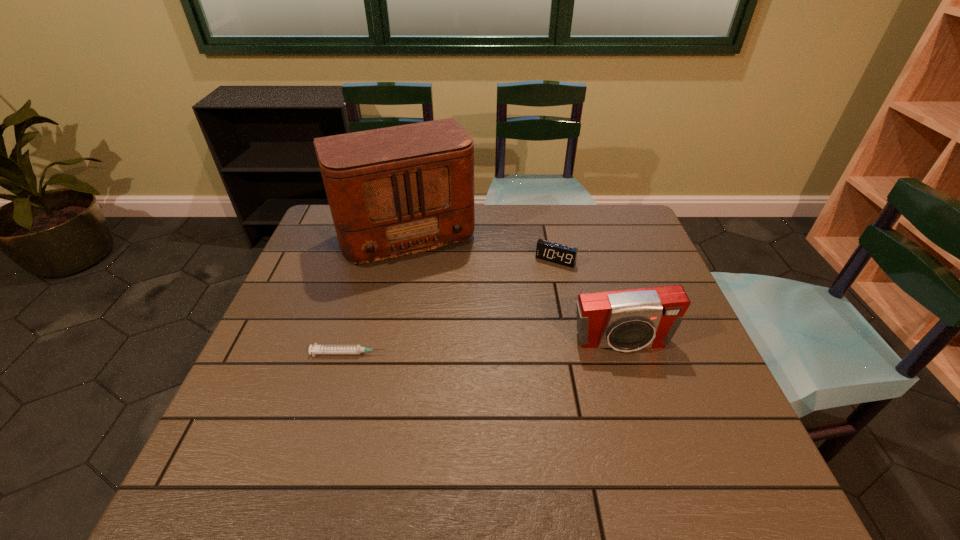
I want to click on the closest object to the camera, so click(549, 251).